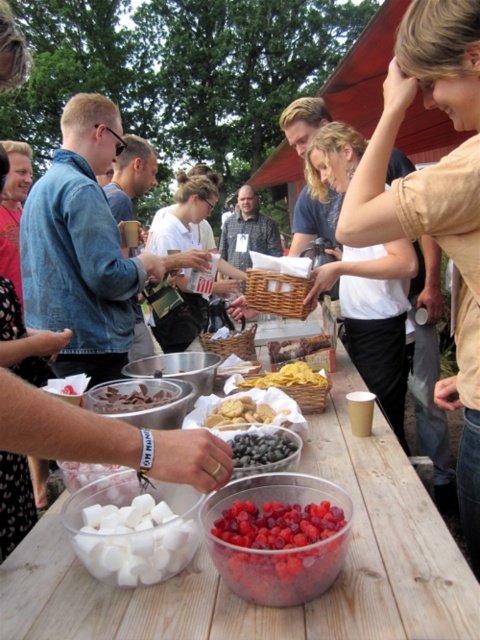
Who is higher up, shiny dark blue grapes at center or yellow crispy chips at center?

yellow crispy chips at center is above.

Find the location of `shiny dark blue grapes at center`. shiny dark blue grapes at center is located at coordinates (264, 451).

Where is `white matte shirt at center`? white matte shirt at center is located at coordinates (184, 212).

Is white matte shirt at center taller than smooth chocolate bar at center?

Yes.

Which is in front, point (211, 172) or point (334, 353)?

Positioned in front is point (334, 353).

Find the location of a particular element. Image resolution: width=480 pixels, height=640 pixels. white matte shirt at center is located at coordinates (184, 212).

Does chocolate-coated nuts at center appear over golden crumbly cookies at center?

Indeed, chocolate-coated nuts at center is positioned over golden crumbly cookies at center.

Does chocolate-coated nuts at center have a larger size compared to golden crumbly cookies at center?

Indeed, chocolate-coated nuts at center has a larger size compared to golden crumbly cookies at center.

The width and height of the screenshot is (480, 640). What do you see at coordinates (131, 396) in the screenshot?
I see `chocolate-coated nuts at center` at bounding box center [131, 396].

Where is `chocolate-coated nuts at center`? chocolate-coated nuts at center is located at coordinates (131, 396).